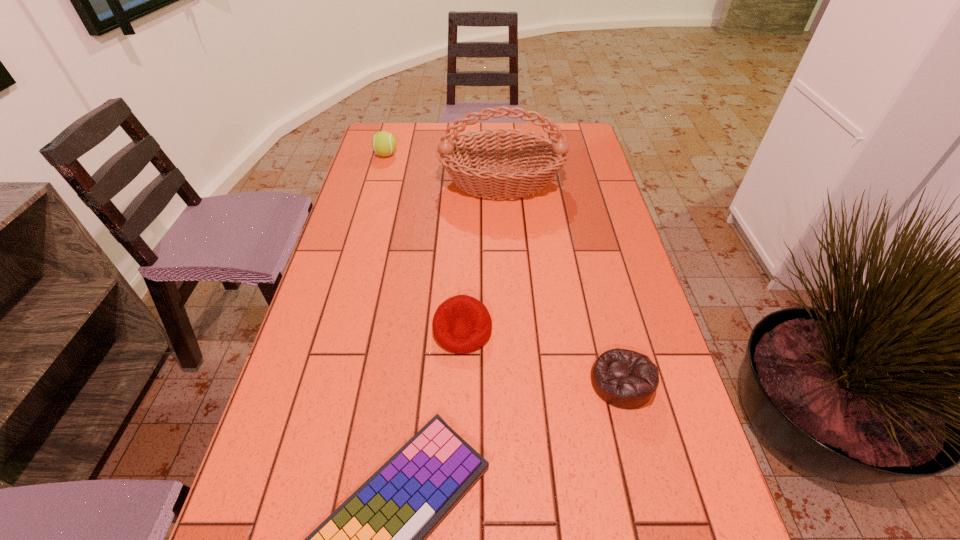
Where is `object at the left edge`? The width and height of the screenshot is (960, 540). object at the left edge is located at coordinates (384, 143).

The width and height of the screenshot is (960, 540). I want to click on basket located at the right edge, so click(x=544, y=157).

Find the location of a particular element. beanbag that is at the right edge is located at coordinates (626, 379).

This screenshot has width=960, height=540. Identify the location of object at the far left corner. (384, 143).

Locate an element on the screen. This screenshot has height=540, width=960. vacant space at the left edge of the desktop is located at coordinates (405, 167).

In order to click on free space at the right edge in this screenshot , I will do `click(626, 411)`.

This screenshot has width=960, height=540. I want to click on vacant point located between the tallest object and the taller beanbag, so click(x=482, y=256).

Find the location of a particular element. vacant space that's between the right beanbag and the basket is located at coordinates point(562,282).

Locate an element on the screen. This screenshot has height=540, width=960. vacant region between the tallest object and the fourth tallest object is located at coordinates (562, 282).

Identify the location of free spot between the right beanbag and the tennis ball. (504, 268).